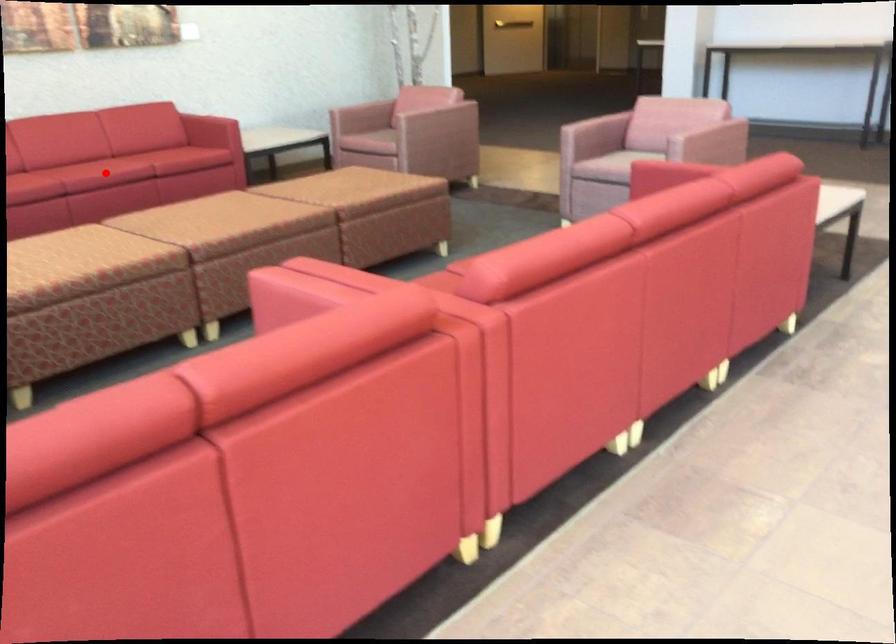
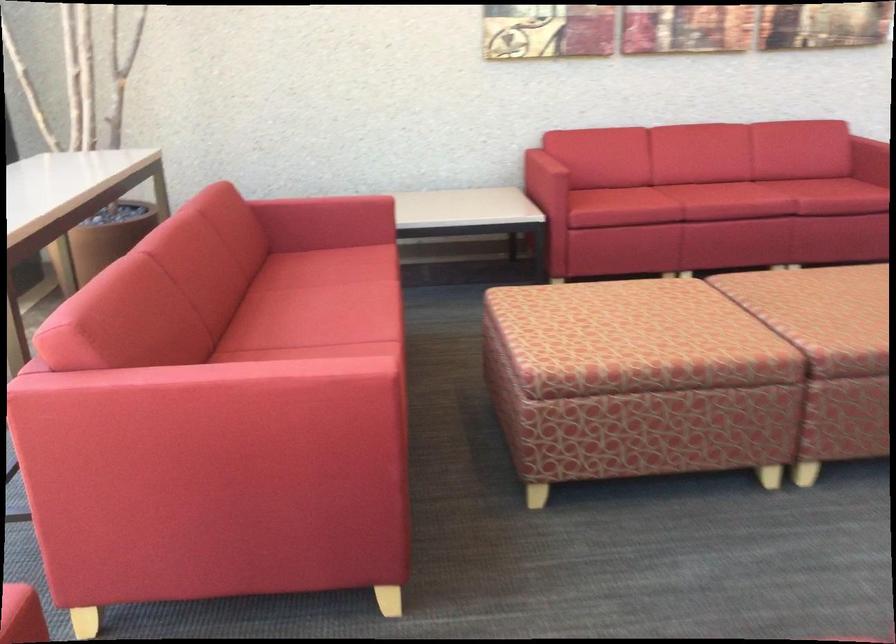
Question: I am providing you with two images of the same scene from different viewpoints. Given a red point in image1, look at the same physical point in image2. Is it:

Choices:
 (A) Closer to the viewpoint
 (B) Farther from the viewpoint

Answer: (A)